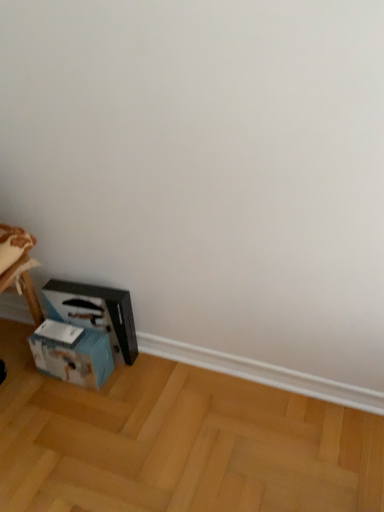
Find the location of a particular element. The image size is (384, 512). vacant space in front of black plastic workbench at lower left is located at coordinates (90, 399).